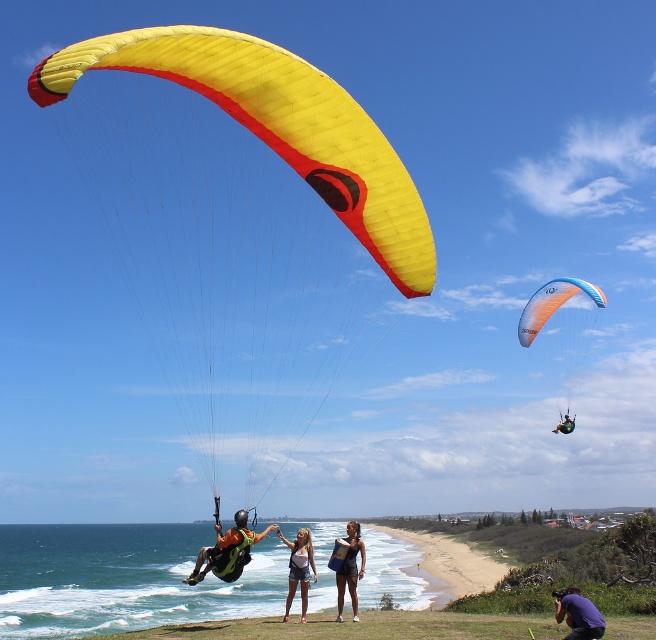
Does yellow matte parachute at center have a lesser width compared to purple fabric camera at lower right?

Incorrect, yellow matte parachute at center's width is not less than purple fabric camera at lower right's.

The image size is (656, 640). Describe the element at coordinates (239, 220) in the screenshot. I see `yellow matte parachute at center` at that location.

Describe the element at coordinates (239, 220) in the screenshot. I see `yellow matte parachute at center` at that location.

Identify the location of yellow matte parachute at center. (239, 220).

Is green fabric parachute at lower left shorter than denim shorts at center?

In fact, green fabric parachute at lower left may be taller than denim shorts at center.

This screenshot has height=640, width=656. Identify the location of green fabric parachute at lower left. (228, 550).

You are a GUI agent. You are given a task and a screenshot of the screen. Output one action in this format:
    pyautogui.click(x=<x>, y=<y>)
    Task: Click on the green fabric parachute at lower left
    Image resolution: width=656 pixels, height=640 pixels.
    Given the screenshot: What is the action you would take?
    pyautogui.click(x=228, y=550)

Is point (552, 301) farther from camera compared to point (562, 620)?

Yes.

Consider the image. Is translucent orange parachute at upper right smaller than purple fabric camera at lower right?

Actually, translucent orange parachute at upper right might be larger than purple fabric camera at lower right.

In the scene shown: Measure the distance between translucent orange parachute at upper right and camera.

33.74 meters

Where is `translucent orange parachute at upper right`? The height and width of the screenshot is (640, 656). translucent orange parachute at upper right is located at coordinates (560, 326).